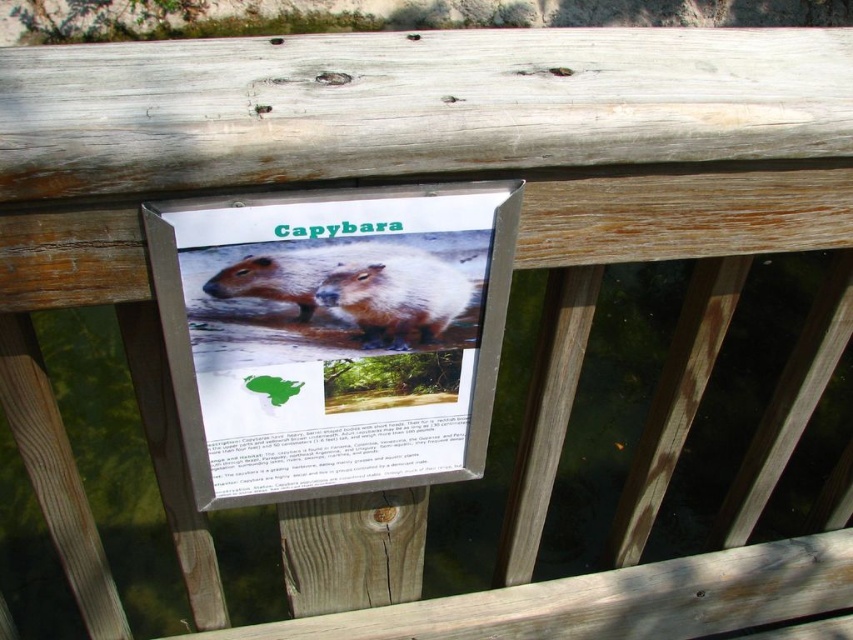
In the scene shown: You are standing in front of the wooden railing with the Capybara signboard. You notice two points marked on the signboard. One is at coordinate point (312, 490) and the other at point (451, 285). Which point is closer to you?

Point (312, 490) is further to the viewer than point (451, 285), so the point at (312, 490) is closer to you.

You are standing in front of the wooden railing with the Capybara signboard. There are two points marked on the signboard at coordinates point (444, 209) and point (316, 256). If you want to touch the point that is nearer to you, which coordinate should you aim for?

You should aim for point (444, 209) because it is closer to the camera than point (316, 256).

You are a wildlife researcher observing the wooden railing with a signboard. You notice two brown furry animals depicted on the signboard. The beaver and the capybara are both at the center of the sign. How far apart are the brown furry beaver at center and the brown furry capybara at center?

The brown furry beaver at center and the brown furry capybara at center are 1.87 inches apart from each other.